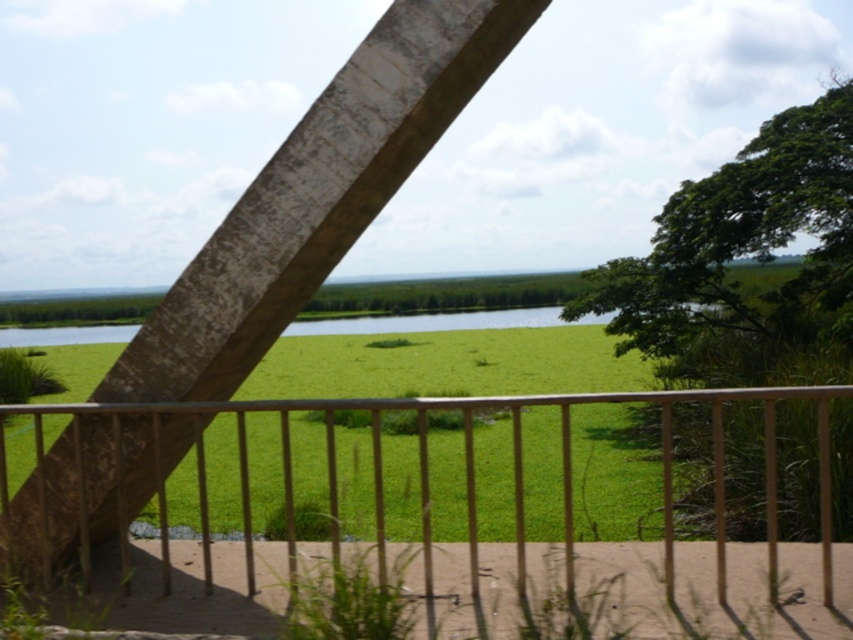
You are a painter standing on the balcony and want to paint the metallic silver balustrade at center and the green grass at lower center. Which object should you focus on if you want to paint the thinner one first?

The metallic silver balustrade at center is thinner than the green grass at lower center, so you should focus on painting the metallic silver balustrade at center first.